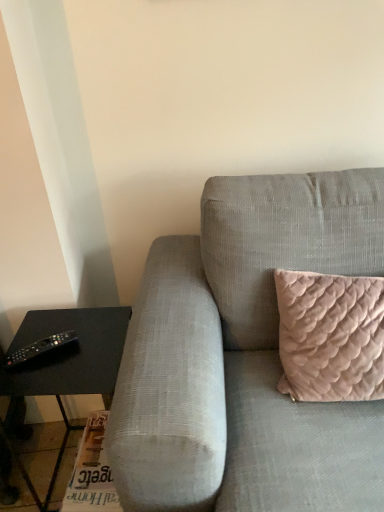
Question: Considering the relative positions of black plastic remote at lower left and black matte table at left in the image provided, is black plastic remote at lower left to the left or to the right of black matte table at left?

Choices:
 (A) right
 (B) left

Answer: (B)

Question: From a real-world perspective, is black plastic remote at lower left physically located above or below black matte table at left?

Choices:
 (A) above
 (B) below

Answer: (A)

Question: Estimate the real-world distances between objects in this image. Which object is closer to the black matte table at left?

Choices:
 (A) textured gray couch at center
 (B) black plastic remote at lower left

Answer: (B)

Question: Estimate the real-world distances between objects in this image. Which object is closer to the black matte table at left?

Choices:
 (A) black plastic remote at lower left
 (B) textured gray couch at center

Answer: (A)